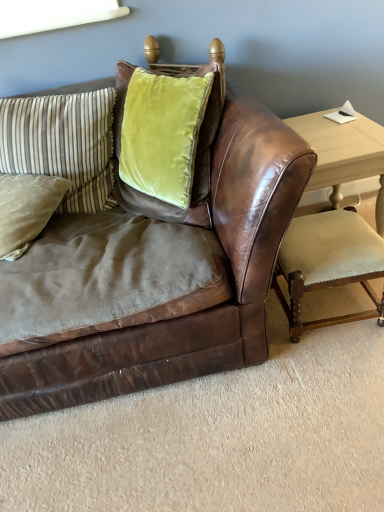
Describe the element at coordinates (344, 154) in the screenshot. I see `light wood table at right` at that location.

Describe the element at coordinates (62, 143) in the screenshot. This screenshot has height=512, width=384. I see `velvet green pillow at upper left, the first pillow when ordered from top to bottom` at that location.

Describe the element at coordinates (154, 280) in the screenshot. I see `brown leather couch at center` at that location.

Where is `suede green pillow at left, acting as the first pillow starting from the bottom`? suede green pillow at left, acting as the first pillow starting from the bottom is located at coordinates (x=26, y=209).

Considering the sizes of objects brown leather couch at center and light wood table at right in the image provided, who is bigger, brown leather couch at center or light wood table at right?

Bigger between the two is brown leather couch at center.

In the image, there is a brown leather couch at center. Identify the location of table below it (from a real-world perspective). This screenshot has width=384, height=512. (344, 154).

From the image's perspective, between brown leather couch at center and light wood table at right, who is located below?

brown leather couch at center is shown below in the image.

Is brown leather couch at center to the left or to the right of light wood table at right in the image?

brown leather couch at center is to the left of light wood table at right.

Is light wood table at right at the back of velvet green pillow at upper left, the 2th pillow from the bottom?

No.

Consider the image. From a real-world perspective, who is located higher, velvet green pillow at upper left, the first pillow when ordered from top to bottom, or light wood table at right?

velvet green pillow at upper left, the first pillow when ordered from top to bottom.

Is velvet green pillow at upper left, the 2th pillow from the bottom, positioned in front of light wood table at right?

Yes, it is in front of light wood table at right.

Which point is more distant from viewer, [17,101] or [381,218]?

The point [381,218] is behind.

From a real-world perspective, is brown leather couch at center positioned under velvet beige armchair at lower right based on gravity?

No, from a real-world perspective, brown leather couch at center is not beneath velvet beige armchair at lower right.

Locate an element on the screen. armchair on the right of the brown leather couch at center is located at coordinates (328, 263).

From the image's perspective, is brown leather couch at center under velvet beige armchair at lower right?

Incorrect, from the image's perspective, brown leather couch at center is higher than velvet beige armchair at lower right.

Does brown leather couch at center turn towards velvet beige armchair at lower right?

No, brown leather couch at center is not facing towards velvet beige armchair at lower right.

In the scene shown: Can you tell me how much suede green pillow at left, which is counted as the 2th pillow, starting from the top, and brown leather couch at center differ in facing direction?

18.6 degrees separate the facing orientations of suede green pillow at left, which is counted as the 2th pillow, starting from the top, and brown leather couch at center.

Who is taller, suede green pillow at left, acting as the first pillow starting from the bottom, or brown leather couch at center?

brown leather couch at center.

Is suede green pillow at left, acting as the first pillow starting from the bottom, touching brown leather couch at center?

No, suede green pillow at left, acting as the first pillow starting from the bottom, is not in contact with brown leather couch at center.

Consider the image. From a real-world perspective, relative to brown leather couch at center, is suede green pillow at left, acting as the first pillow starting from the bottom, vertically above or below?

In terms of real-world spatial position, suede green pillow at left, acting as the first pillow starting from the bottom, is above brown leather couch at center.

Where is `studio couch that appears above the suede green pillow at left, acting as the first pillow starting from the bottom (from the image's perspective)`? The width and height of the screenshot is (384, 512). studio couch that appears above the suede green pillow at left, acting as the first pillow starting from the bottom (from the image's perspective) is located at coordinates (154, 280).

Does brown leather couch at center appear on the right side of suede green pillow at left, acting as the first pillow starting from the bottom?

Correct, you'll find brown leather couch at center to the right of suede green pillow at left, acting as the first pillow starting from the bottom.

Relative to suede green pillow at left, acting as the first pillow starting from the bottom, is brown leather couch at center in front or behind?

Clearly, brown leather couch at center is in front of suede green pillow at left, acting as the first pillow starting from the bottom.

Can you confirm if brown leather couch at center is shorter than suede green pillow at left, which is counted as the 2th pillow, starting from the top?

No.

Is velvet green pillow at upper left, the 2th pillow from the bottom, oriented away from velvet beige armchair at lower right?

No, velvet beige armchair at lower right is not at the back of velvet green pillow at upper left, the 2th pillow from the bottom.

Looking at this image, how different are the orientations of velvet green pillow at upper left, the 2th pillow from the bottom, and velvet beige armchair at lower right in degrees?

The angular difference between velvet green pillow at upper left, the 2th pillow from the bottom, and velvet beige armchair at lower right is 1.25 degrees.

From a real-world perspective, is velvet green pillow at upper left, the 2th pillow from the bottom, positioned above or below velvet beige armchair at lower right?

Clearly, from a real-world perspective, velvet green pillow at upper left, the 2th pillow from the bottom, is above velvet beige armchair at lower right.

In the image, is velvet green pillow at upper left, the 2th pillow from the bottom, positioned in front of or behind velvet beige armchair at lower right?

Visually, velvet green pillow at upper left, the 2th pillow from the bottom, is located behind velvet beige armchair at lower right.

Is velvet beige armchair at lower right next to light wood table at right?

No, velvet beige armchair at lower right is not making contact with light wood table at right.

From a real-world perspective, is velvet beige armchair at lower right physically located above or below light wood table at right?

velvet beige armchair at lower right is below light wood table at right.

Is velvet beige armchair at lower right spatially inside light wood table at right, or outside of it?

velvet beige armchair at lower right is outside light wood table at right.

I want to click on table behind the brown leather couch at center, so click(x=344, y=154).

The height and width of the screenshot is (512, 384). I want to click on the 2nd pillow positioned above the light wood table at right (from a real-world perspective), so click(62, 143).

Looking at the image, which one is located further to suede green pillow at left, which is counted as the 2th pillow, starting from the top, brown leather couch at center or velvet beige armchair at lower right?

Based on the image, velvet beige armchair at lower right appears to be further to suede green pillow at left, which is counted as the 2th pillow, starting from the top.

From the image, which object appears to be farther from light wood table at right, velvet beige armchair at lower right or brown leather couch at center?

Among the two, brown leather couch at center is located further to light wood table at right.

Considering their positions, is velvet beige armchair at lower right positioned further to suede green pillow at left, which is counted as the 2th pillow, starting from the top, than light wood table at right?

The object further to suede green pillow at left, which is counted as the 2th pillow, starting from the top, is light wood table at right.

When comparing their distances from light wood table at right, does brown leather couch at center or suede green pillow at left, acting as the first pillow starting from the bottom, seem further?

Among the two, suede green pillow at left, acting as the first pillow starting from the bottom, is located further to light wood table at right.

Which object lies further to the anchor point velvet beige armchair at lower right, light wood table at right or suede green pillow at left, acting as the first pillow starting from the bottom?

suede green pillow at left, acting as the first pillow starting from the bottom, is further to velvet beige armchair at lower right.

Estimate the real-world distances between objects in this image. Which object is further from velvet green pillow at upper left, the first pillow when ordered from top to bottom, light wood table at right or suede green pillow at left, acting as the first pillow starting from the bottom?

Among the two, light wood table at right is located further to velvet green pillow at upper left, the first pillow when ordered from top to bottom.

When comparing their distances from velvet beige armchair at lower right, does velvet green pillow at upper left, the 2th pillow from the bottom, or brown leather couch at center seem closer?

The object closer to velvet beige armchair at lower right is brown leather couch at center.

In the scene shown: When comparing their distances from suede green pillow at left, acting as the first pillow starting from the bottom, does brown leather couch at center or velvet green pillow at upper left, the 2th pillow from the bottom, seem closer?

velvet green pillow at upper left, the 2th pillow from the bottom, is closer to suede green pillow at left, acting as the first pillow starting from the bottom.

This screenshot has height=512, width=384. In order to click on pillow located between suede green pillow at left, which is counted as the 2th pillow, starting from the top, and light wood table at right in the left-right direction in this screenshot , I will do `click(62, 143)`.

Identify the location of armchair between suede green pillow at left, which is counted as the 2th pillow, starting from the top, and light wood table at right, in the horizontal direction. (328, 263).

Where is `studio couch between velvet green pillow at upper left, the first pillow when ordered from top to bottom, and light wood table at right`? studio couch between velvet green pillow at upper left, the first pillow when ordered from top to bottom, and light wood table at right is located at coordinates (154, 280).

The height and width of the screenshot is (512, 384). Find the location of `armchair between brown leather couch at center and light wood table at right`. armchair between brown leather couch at center and light wood table at right is located at coordinates (328, 263).